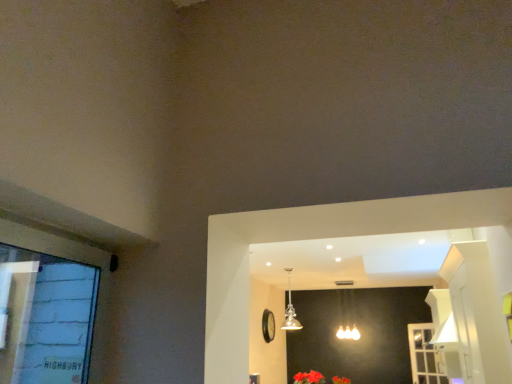
Question: Does white plastic screen door at lower right have a larger size compared to matte silver lamp at center, the first lamp when ordered from right to left?

Choices:
 (A) yes
 (B) no

Answer: (B)

Question: Is white plastic screen door at lower right positioned behind matte silver lamp at center, the first lamp when ordered from right to left?

Choices:
 (A) no
 (B) yes

Answer: (A)

Question: Considering the relative sizes of white plastic screen door at lower right and matte silver lamp at center, arranged as the 2th lamp when viewed from the front, in the image provided, is white plastic screen door at lower right smaller than matte silver lamp at center, arranged as the 2th lamp when viewed from the front,?

Choices:
 (A) no
 (B) yes

Answer: (B)

Question: Could you tell me if white plastic screen door at lower right is facing matte silver lamp at center, arranged as the 2th lamp when viewed from the front?

Choices:
 (A) no
 (B) yes

Answer: (A)

Question: Does white plastic screen door at lower right appear on the right side of matte silver lamp at center, arranged as the 2th lamp when viewed from the front?

Choices:
 (A) no
 (B) yes

Answer: (B)

Question: From the image's perspective, is gold glass pendant light at center, the first lamp positioned from the left, positioned above or below vivid red petals at lower center, marked as the 1th flower in a left-to-right arrangement?

Choices:
 (A) below
 (B) above

Answer: (B)

Question: Choose the correct answer: Is gold glass pendant light at center, the first lamp positioned from the left, inside vivid red petals at lower center, marked as the 1th flower in a left-to-right arrangement, or outside it?

Choices:
 (A) outside
 (B) inside

Answer: (A)

Question: In the image, is gold glass pendant light at center, the 2th lamp from the right, positioned in front of or behind vivid red petals at lower center, marked as the 1th flower in a left-to-right arrangement?

Choices:
 (A) front
 (B) behind

Answer: (B)

Question: Considering the positions of gold glass pendant light at center, which is the second lamp from back to front, and vivid red petals at lower center, the 1th flower when ordered from front to back, in the image, is gold glass pendant light at center, which is the second lamp from back to front, taller or shorter than vivid red petals at lower center, the 1th flower when ordered from front to back,?

Choices:
 (A) tall
 (B) short

Answer: (A)

Question: From a real-world perspective, is vivid red petals at lower center, which is the second flower from right to left, positioned above or below matte silver lamp at center, which is the 1th lamp from back to front?

Choices:
 (A) above
 (B) below

Answer: (B)

Question: Considering the positions of point (297, 380) and point (342, 337), is point (297, 380) closer or farther from the camera than point (342, 337)?

Choices:
 (A) farther
 (B) closer

Answer: (B)

Question: In the image, is vivid red petals at lower center, which is the second flower from right to left, on the left side or the right side of matte silver lamp at center, the first lamp when ordered from right to left?

Choices:
 (A) left
 (B) right

Answer: (A)

Question: Is vivid red petals at lower center, the 2th flower from the back, bigger or smaller than matte silver lamp at center, arranged as the 2th lamp when viewed from the front?

Choices:
 (A) big
 (B) small

Answer: (B)

Question: Would you say vivid red petals at lower center, which is the second flower from right to left, is inside or outside white plastic screen door at lower right?

Choices:
 (A) inside
 (B) outside

Answer: (B)

Question: Is point (324, 382) positioned closer to the camera than point (425, 380)?

Choices:
 (A) closer
 (B) farther

Answer: (B)